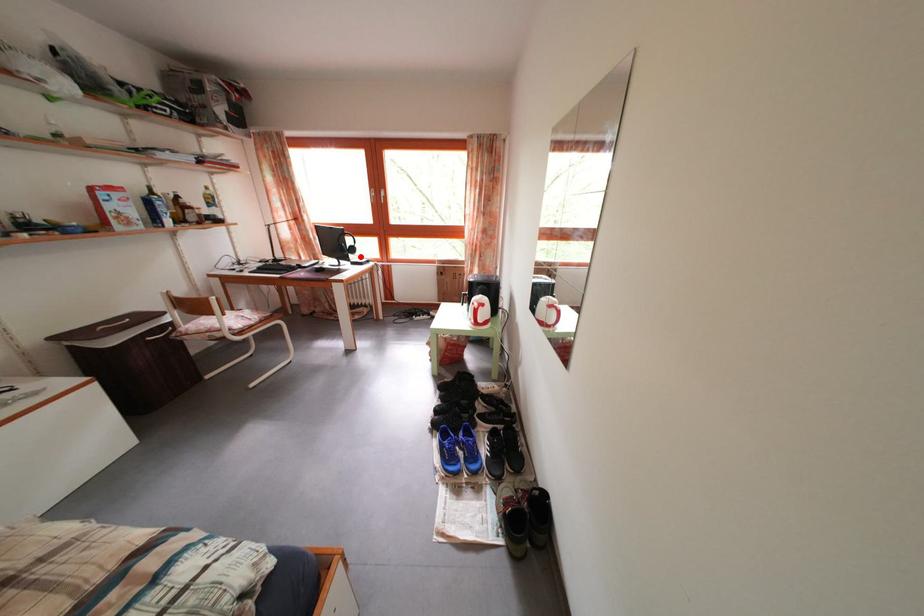
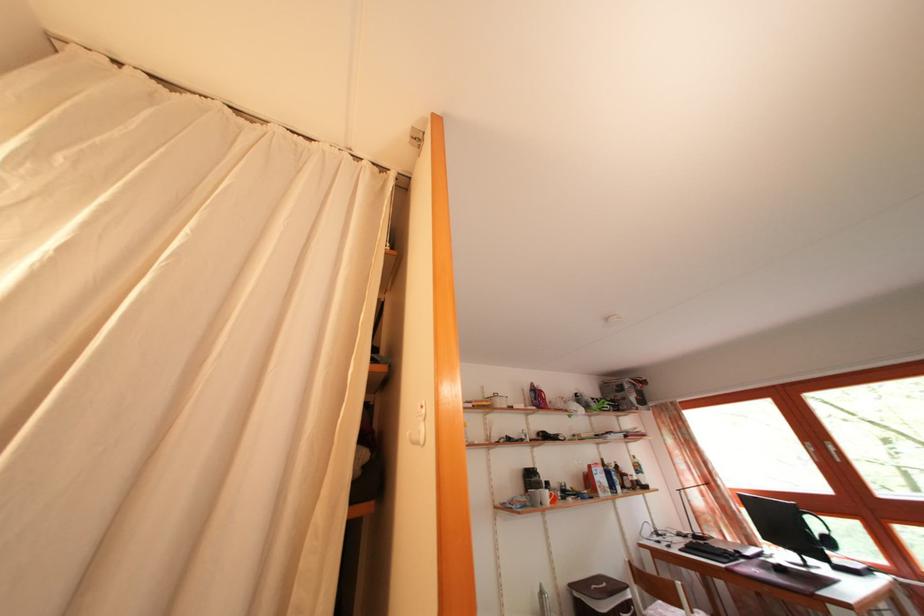
Locate, in the second image, the point that corresponds to the highlighted location in the first image.

(837, 549)